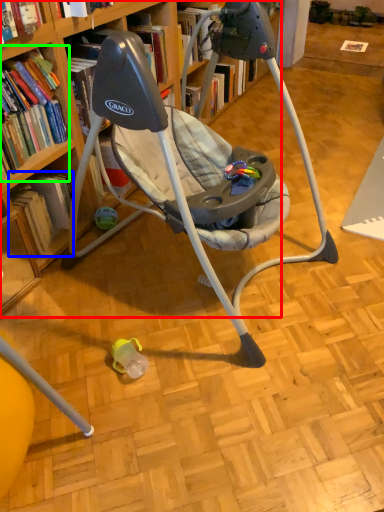
Question: Estimate the real-world distances between objects in this image. Which object is closer to bookcase (highlighted by a red box), book (highlighted by a blue box) or book (highlighted by a green box)?

Choices:
 (A) book
 (B) book

Answer: (A)